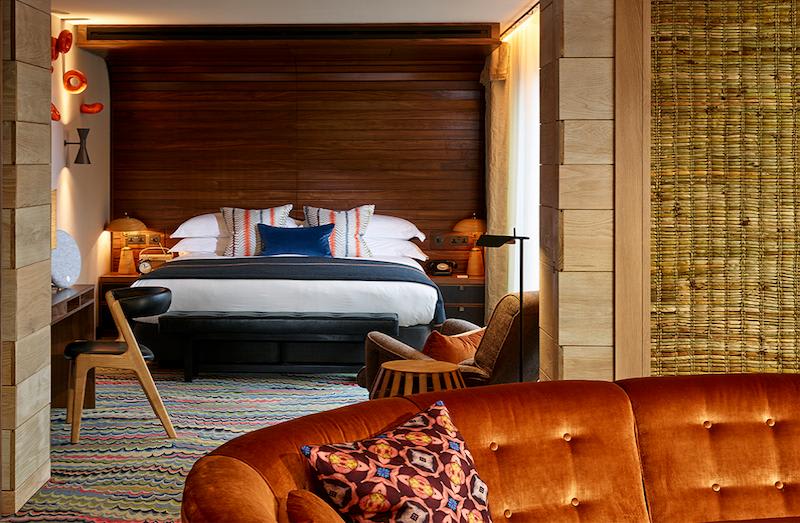
Locate an element on the screen. The image size is (800, 523). light colored wooden walls is located at coordinates (580, 173), (20, 233).